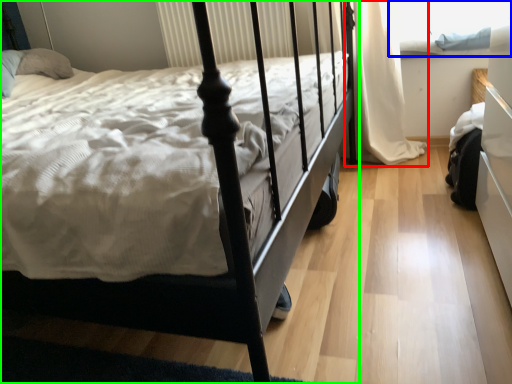
Question: Which is farther away from curtain (highlighted by a red box)? window screen (highlighted by a blue box) or bed (highlighted by a green box)?

Choices:
 (A) window screen
 (B) bed

Answer: (B)